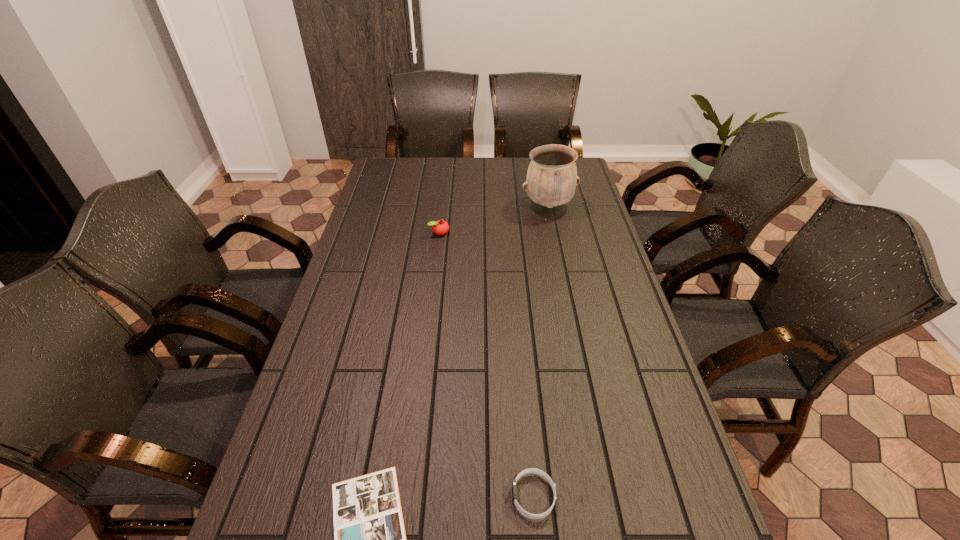
You are a GUI agent. You are given a task and a screenshot of the screen. Output one action in this format:
    pyautogui.click(x=<x>, y=<y>)
    Task: Click on the vacant region located 0.160m on the outer surface of the third object from left to right
    This screenshot has height=540, width=960.
    Given the screenshot: What is the action you would take?
    pyautogui.click(x=435, y=496)

Locate an element on the screen. Image resolution: width=960 pixels, height=540 pixels. object at the right edge is located at coordinates (551, 181).

In the image, there is a desktop. Identify the location of vacant space at the far edge. (416, 174).

Where is `vacant position at the left edge of the desktop`? The image size is (960, 540). vacant position at the left edge of the desktop is located at coordinates (354, 435).

Identify the location of vacant space at the right edge of the desktop. [x=667, y=481].

Where is `blank area at the far left corner`? The image size is (960, 540). blank area at the far left corner is located at coordinates (407, 177).

The width and height of the screenshot is (960, 540). I want to click on free spot between the third tallest object and the rightmost object, so click(541, 351).

Locate an element on the screen. This screenshot has width=960, height=540. empty location between the urn and the wristband is located at coordinates (541, 351).

This screenshot has height=540, width=960. I want to click on free area in between the second farthest object and the tallest object, so click(494, 219).

At what (x,y) coordinates should I click in order to perform the action: click on vacant area that lies between the third object from left to right and the farthest object. Please return your answer as a coordinate pair (x, y). This screenshot has height=540, width=960. Looking at the image, I should click on (541, 351).